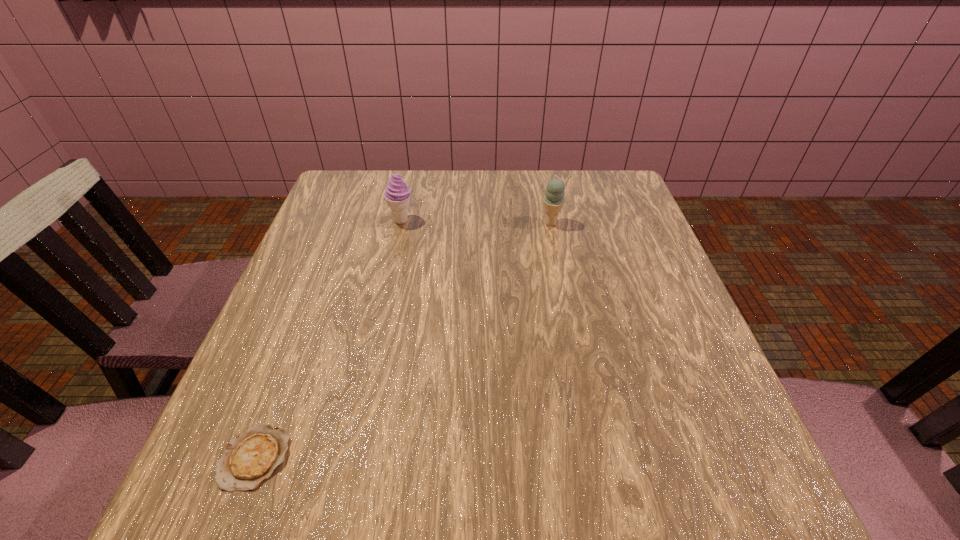
This screenshot has width=960, height=540. In the image, there is a desktop. Identify the location of vacant area at the far edge. (463, 192).

Where is `vacant space at the near edge of the desktop`? vacant space at the near edge of the desktop is located at coordinates (442, 478).

Where is `free region at the left edge of the desktop`? free region at the left edge of the desktop is located at coordinates (293, 399).

Locate an element on the screen. Image resolution: width=960 pixels, height=540 pixels. vacant space at the right edge is located at coordinates (657, 445).

I want to click on free space at the far left corner of the desktop, so pyautogui.click(x=373, y=170).

This screenshot has height=540, width=960. Identify the location of vacant space at the far right corner of the desktop. (637, 202).

Locate an element on the screen. The width and height of the screenshot is (960, 540). empty space that is in between the shortest object and the left ice cream is located at coordinates (328, 339).

Identify the location of free space between the quiche and the second object from left to right. This screenshot has width=960, height=540. (328, 339).

The width and height of the screenshot is (960, 540). Find the location of `vacant point located between the quiche and the rightmost object`. vacant point located between the quiche and the rightmost object is located at coordinates click(403, 340).

This screenshot has height=540, width=960. Identify the location of vacant area that lies between the right ice cream and the left ice cream. (476, 222).